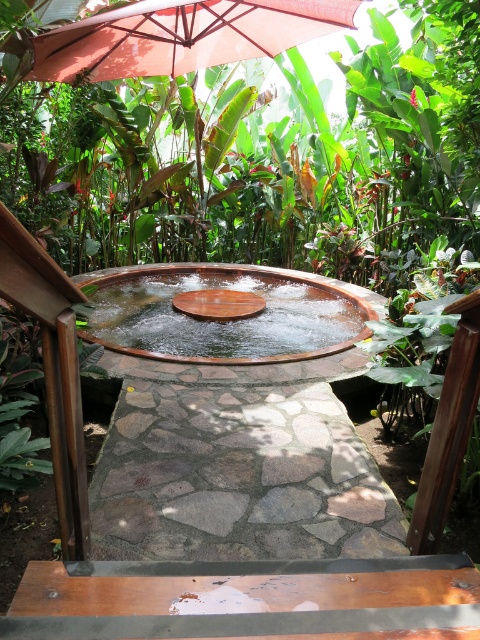
Based on the photo, you are standing at the edge of the circular hot tub in the center of the tropical spa area. You see two points marked on the wooden platform surrounding the pool. The first point is at coordinates point (199,605), and the second is at point (108,72). If you want to move from the hot tub to the point that is closer to you, which coordinate should you head towards?

You should head towards point (199,605) because it is in front of point (108,72), meaning it is closer to your current position at the edge of the hot tub.

You are planning to place a new bench in the spa area. The bench requires 2 square meters of space. Given the available space around the brown wooden table at lower center and the matte red umbrella at upper center, which object can accommodate the bench?

The matte red umbrella at upper center can accommodate the bench since it occupies more space than the brown wooden table at lower center.